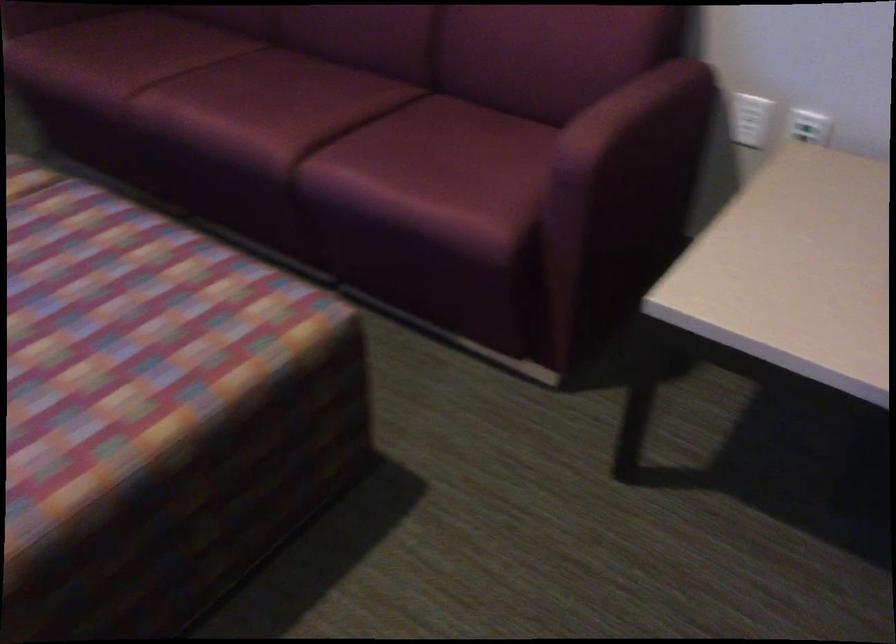
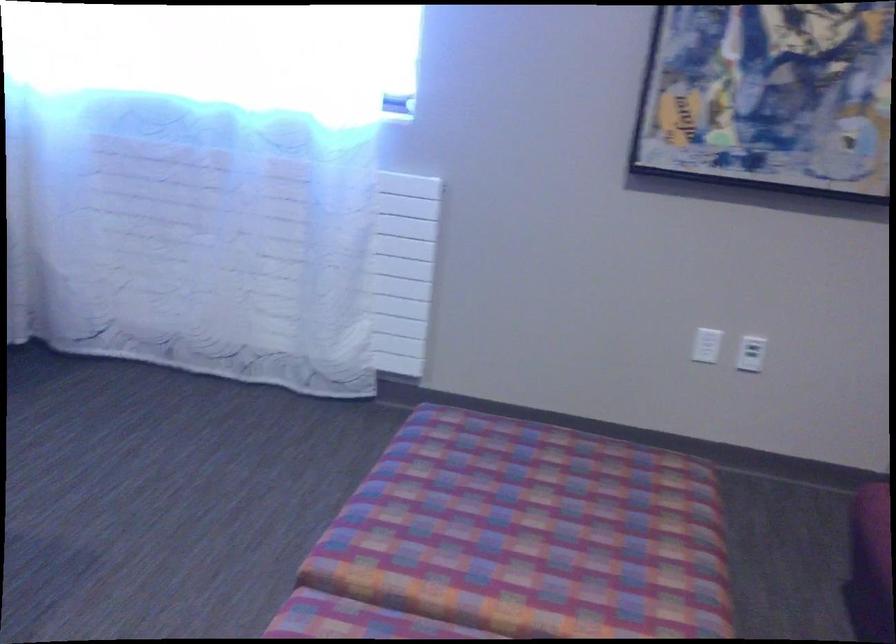
Question: The first image is from the beginning of the video and the second image is from the end. How did the camera likely rotate when shooting the video?

Choices:
 (A) Left
 (B) Right
 (C) Up
 (D) Down

Answer: (A)